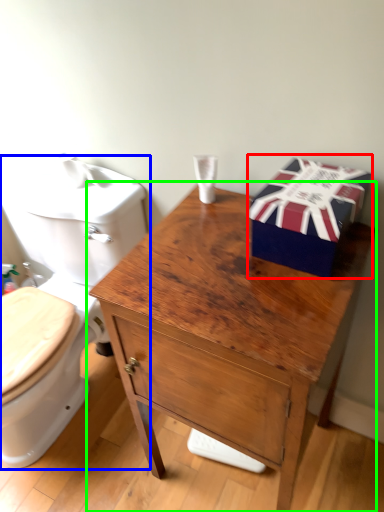
Question: Which is nearer to the gift box (highlighted by a red box)? toilet (highlighted by a blue box) or table (highlighted by a green box).

Choices:
 (A) toilet
 (B) table

Answer: (B)